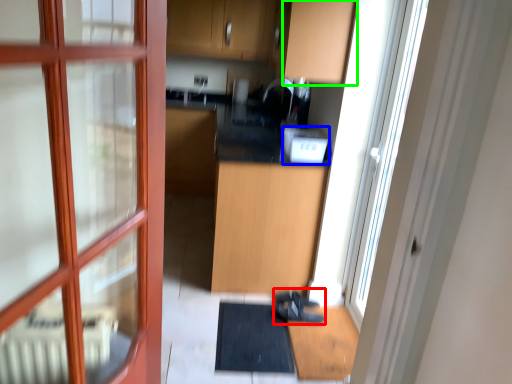
Question: Based on their relative distances, which object is farther from shoe (highlighted by a red box)? Choose from appliance (highlighted by a blue box) and cabinetry (highlighted by a green box).

Choices:
 (A) appliance
 (B) cabinetry

Answer: (B)